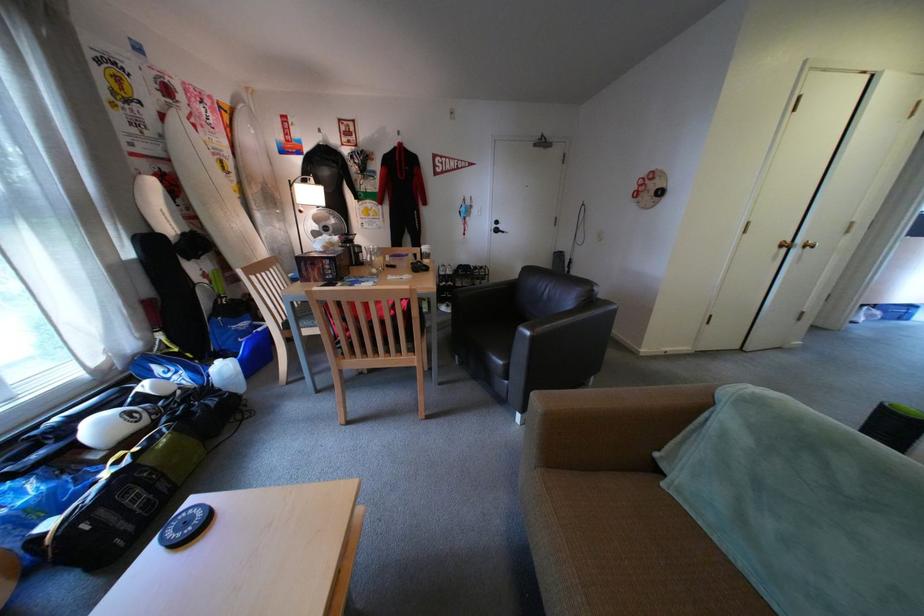
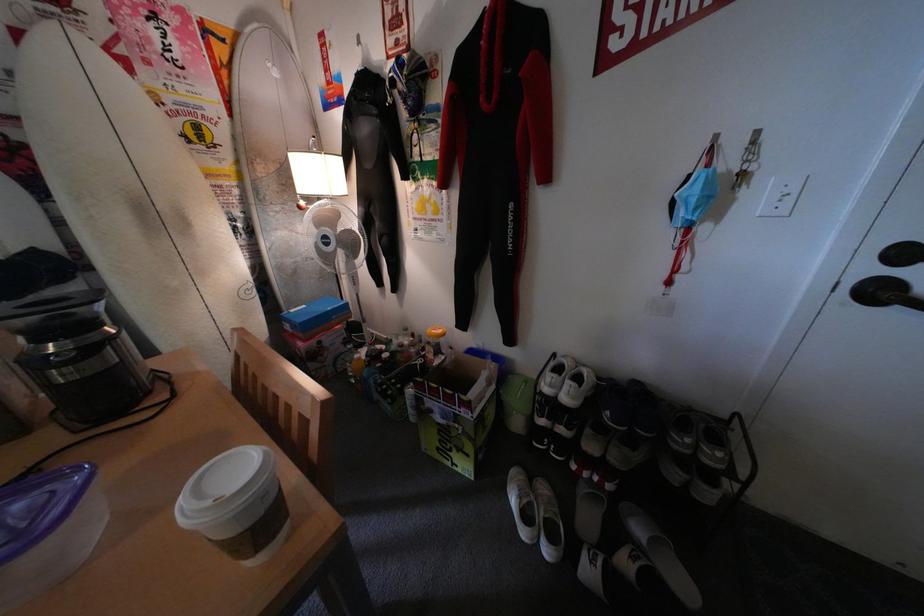
In the second image, find the point that corresponds to point 481,204 in the first image.

(744, 161)